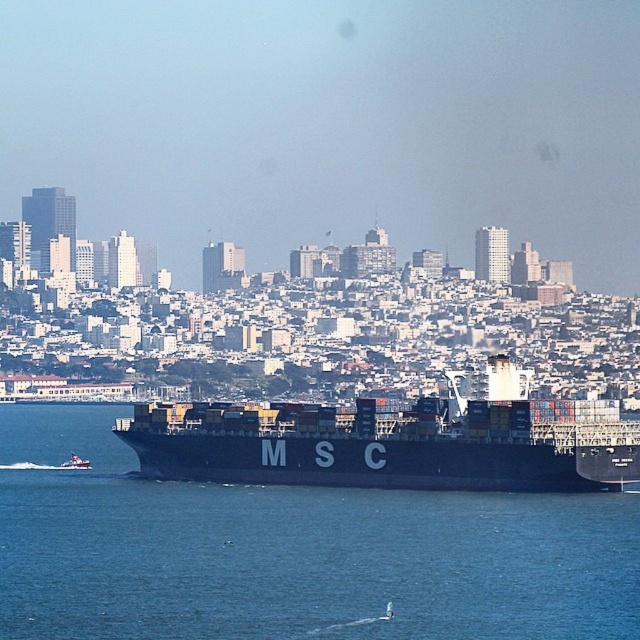
Question: Considering the relative positions of black matte water at center and white glossy boat at lower left in the image provided, where is black matte water at center located with respect to white glossy boat at lower left?

Choices:
 (A) above
 (B) below

Answer: (B)

Question: Which object is the closest to the black matte cargo ship at center?

Choices:
 (A) black matte water at center
 (B) white glossy boat at lower left

Answer: (A)

Question: Is black matte cargo ship at center further to the viewer compared to white glossy boat at lower left?

Choices:
 (A) yes
 (B) no

Answer: (B)

Question: Is black matte water at center thinner than white glossy boat at lower left?

Choices:
 (A) no
 (B) yes

Answer: (A)

Question: Among these objects, which one is nearest to the camera?

Choices:
 (A) black matte cargo ship at center
 (B) white glossy boat at lower left
 (C) black matte water at center

Answer: (A)

Question: Estimate the real-world distances between objects in this image. Which object is closer to the black matte water at center?

Choices:
 (A) black matte cargo ship at center
 (B) white glossy boat at lower left

Answer: (A)